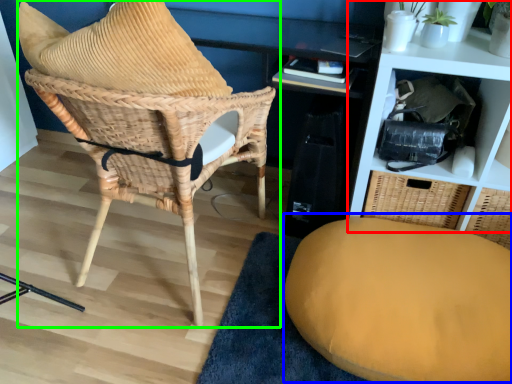
Question: Based on their relative distances, which object is farther from shelf (highlighted by a red box)? Choose from swivel chair (highlighted by a blue box) and chair (highlighted by a green box).

Choices:
 (A) swivel chair
 (B) chair

Answer: (B)